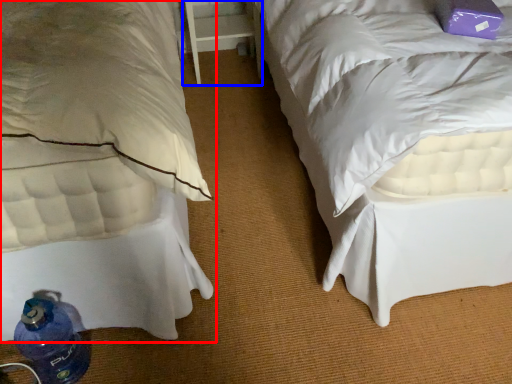
Question: Which object is further to the camera taking this photo, bed (highlighted by a red box) or table (highlighted by a blue box)?

Choices:
 (A) bed
 (B) table

Answer: (B)